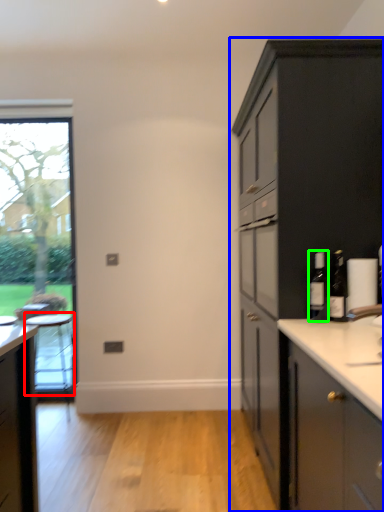
Question: Which object is positioned closest to table (highlighted by a red box)? Select from cabinetry (highlighted by a blue box) and bottle (highlighted by a green box).

Choices:
 (A) cabinetry
 (B) bottle

Answer: (A)